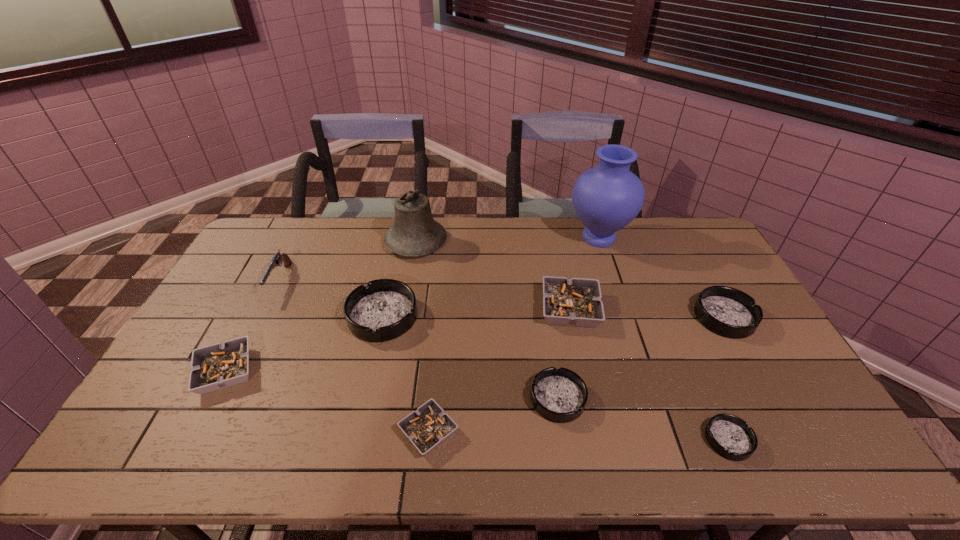
Locate which gray ashtray ranks second in proximity to the nearest gray ashtray. Please provide its 2D coordinates. Your answer should be formatted as a tuple, i.e. [(x, y)], where the tuple contains the x and y coordinates of a point satisfying the conditions above.

[(217, 366)]

Locate an element on the screen. Image resolution: width=960 pixels, height=540 pixels. gray ashtray identified as the closest to the nearest gray ashtray is located at coordinates point(576,302).

At what (x,y) coordinates should I click in order to perform the action: click on blank area in the image that satisfies the following two spatial constraints: 1. on the back side of the nearest gray ashtray; 2. on the right side of the vase. Please return your answer as a coordinate pair (x, y). This screenshot has width=960, height=540. Looking at the image, I should click on (446, 238).

Identify the location of free location that satisfies the following two spatial constraints: 1. aiming along the barrel of the gun; 2. on the right side of the rightmost gray ashtray. (266, 309).

This screenshot has height=540, width=960. Find the location of `vacant region that satisfies the following two spatial constraints: 1. aiming along the barrel of the eighth shortest object; 2. on the right side of the smallest gray ashtray`. vacant region that satisfies the following two spatial constraints: 1. aiming along the barrel of the eighth shortest object; 2. on the right side of the smallest gray ashtray is located at coordinates (204, 432).